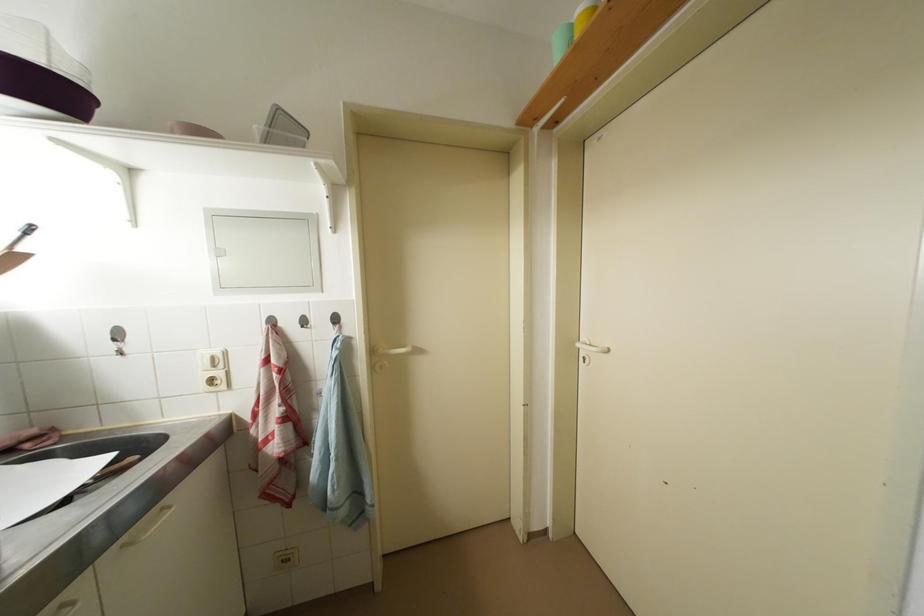
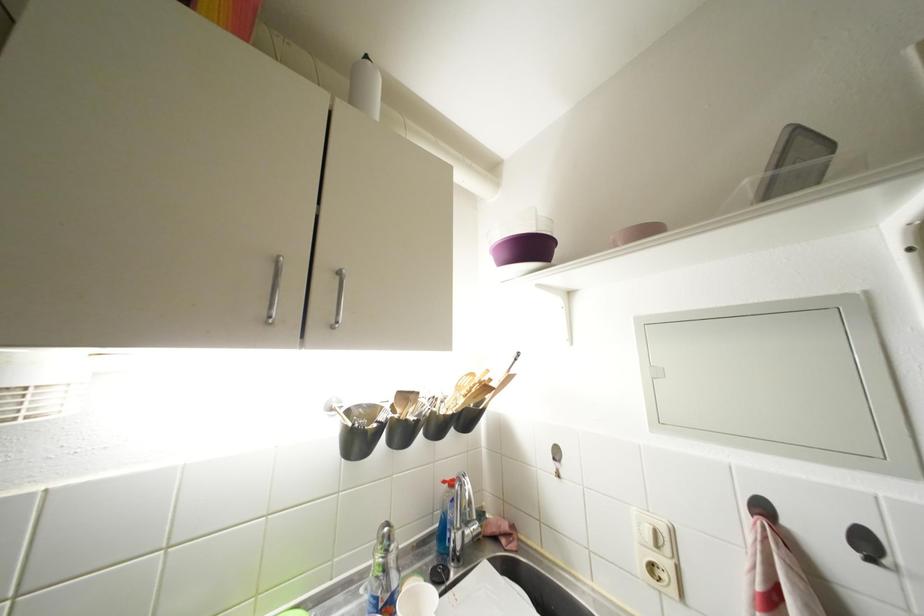
In the second image, find the point that corresponds to (310,331) in the first image.

(877, 565)